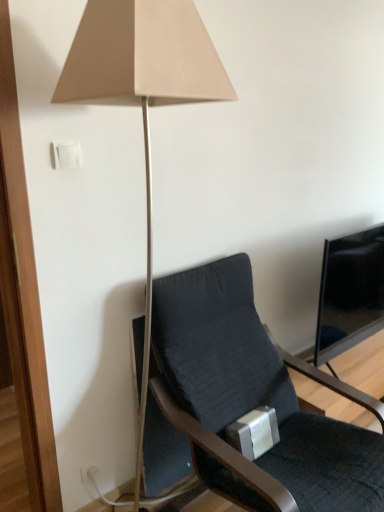
Question: From a real-world perspective, is dark gray fabric chair at center beneath white plastic light switch at upper left?

Choices:
 (A) no
 (B) yes

Answer: (B)

Question: Does dark gray fabric chair at center turn towards white plastic light switch at upper left?

Choices:
 (A) yes
 (B) no

Answer: (B)

Question: Can you confirm if dark gray fabric chair at center is thinner than white plastic light switch at upper left?

Choices:
 (A) yes
 (B) no

Answer: (B)

Question: From the image's perspective, does dark gray fabric chair at center appear lower than white plastic light switch at upper left?

Choices:
 (A) yes
 (B) no

Answer: (A)

Question: Does dark gray fabric chair at center lie behind white plastic light switch at upper left?

Choices:
 (A) no
 (B) yes

Answer: (A)

Question: From the image's perspective, is white plastic light switch at upper left above or below dark gray fabric chair at center?

Choices:
 (A) above
 (B) below

Answer: (A)

Question: Does point (51, 150) appear closer or farther from the camera than point (380, 459)?

Choices:
 (A) closer
 (B) farther

Answer: (A)

Question: In the image, is white plastic light switch at upper left on the left side or the right side of dark gray fabric chair at center?

Choices:
 (A) right
 (B) left

Answer: (B)

Question: From a real-world perspective, is white plastic light switch at upper left above or below dark gray fabric chair at center?

Choices:
 (A) above
 (B) below

Answer: (A)

Question: From a real-world perspective, relative to black glossy screen at right, is matte beige lamp at upper center vertically above or below?

Choices:
 (A) above
 (B) below

Answer: (A)

Question: Looking at the image, does matte beige lamp at upper center seem bigger or smaller compared to black glossy screen at right?

Choices:
 (A) small
 (B) big

Answer: (B)

Question: Considering the relative positions of matte beige lamp at upper center and black glossy screen at right in the image provided, is matte beige lamp at upper center to the left or to the right of black glossy screen at right?

Choices:
 (A) left
 (B) right

Answer: (A)

Question: In terms of width, does matte beige lamp at upper center look wider or thinner when compared to black glossy screen at right?

Choices:
 (A) wide
 (B) thin

Answer: (A)

Question: Considering their positions, is dark gray fabric chair at center located in front of or behind matte beige lamp at upper center?

Choices:
 (A) behind
 (B) front

Answer: (A)

Question: Considering the positions of point (x=296, y=478) and point (x=206, y=92), is point (x=296, y=478) closer or farther from the camera than point (x=206, y=92)?

Choices:
 (A) closer
 (B) farther

Answer: (B)